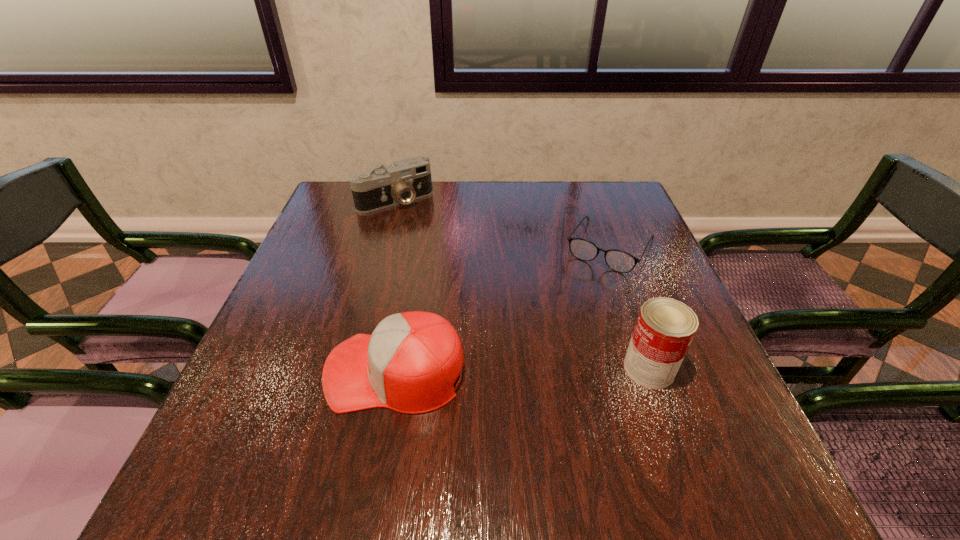
You are a GUI agent. You are given a task and a screenshot of the screen. Output one action in this format:
    pyautogui.click(x=<x>, y=<y>)
    Task: Click on the free space on the desktop that is between the baseball cap and the can and is positioned on the front-facing side of the shortest object
    This screenshot has height=540, width=960.
    Given the screenshot: What is the action you would take?
    pyautogui.click(x=538, y=370)

Find the location of a particular element. The width and height of the screenshot is (960, 540). free space on the desktop that is between the baseball cap and the can and is positioned on the lens of the camera is located at coordinates (532, 370).